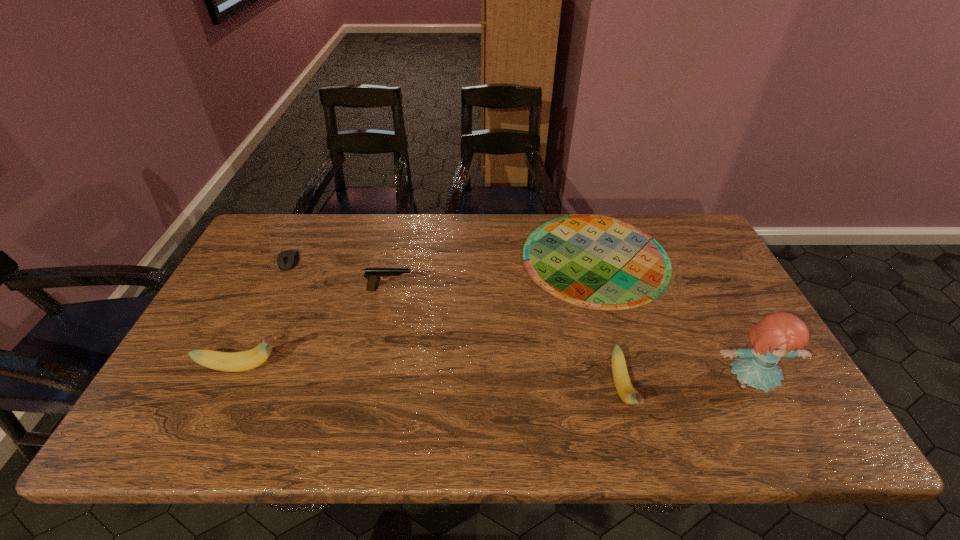
To ensure equal spacing by inserting another banana among them, please point out a vacant spot for this new banana. Please provide its 2D coordinates. Your answer should be formatted as a tuple, i.e. [(x, y)], where the tuple contains the x and y coordinates of a point satisfying the conditions above.

[(429, 377)]